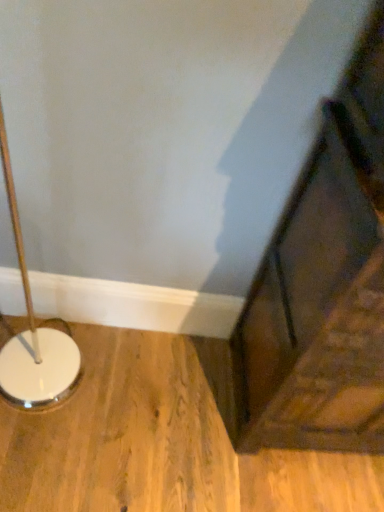
Where is `free space to the left of wooden bed frame at right`? Image resolution: width=384 pixels, height=512 pixels. free space to the left of wooden bed frame at right is located at coordinates (154, 408).